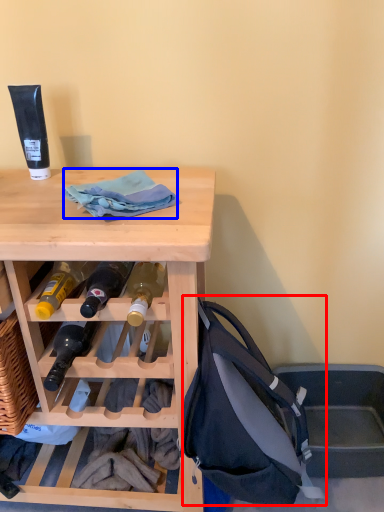
Question: Which of the following is the farthest to the observer, handbag (highlighted by a red box) or cloth (highlighted by a blue box)?

Choices:
 (A) handbag
 (B) cloth

Answer: (B)